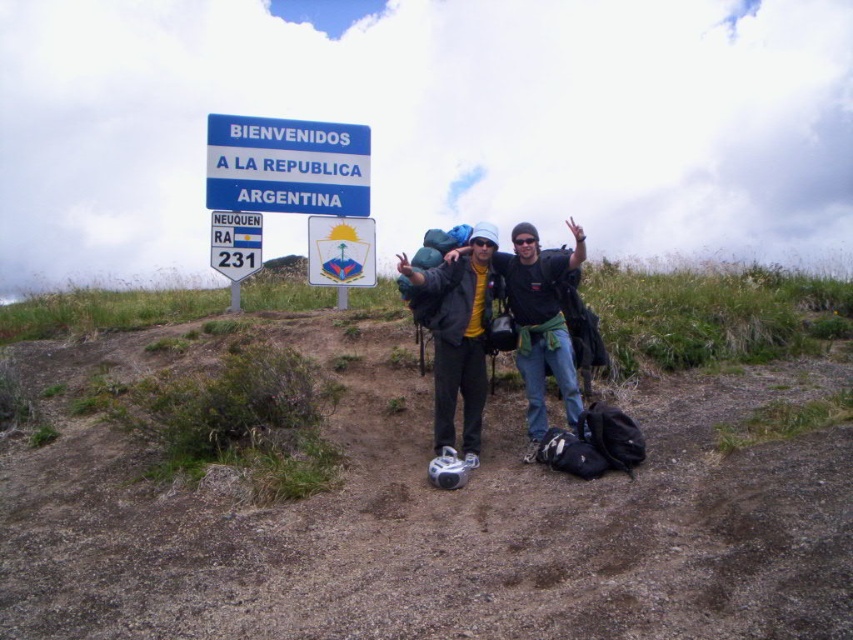
Question: Is matte black jacket at center above matte plastic sign at upper center?

Choices:
 (A) no
 (B) yes

Answer: (A)

Question: Among these points, which one is farthest from the camera?

Choices:
 (A) (514, 300)
 (B) (364, 236)
 (C) (215, 266)

Answer: (B)

Question: Which is farther from the matte black jacket at center?

Choices:
 (A) matte plastic sign at upper center
 (B) white plastic sign at upper center

Answer: (B)

Question: Considering the relative positions of matte black jacket at center and blue plastic sign at upper center in the image provided, where is matte black jacket at center located with respect to blue plastic sign at upper center?

Choices:
 (A) below
 (B) above

Answer: (A)

Question: Which object is positioned farthest from the white plastic sign at upper center?

Choices:
 (A) matte black jacket at center
 (B) blue plastic sign at upper center
 (C) matte plastic sign at upper center

Answer: (A)

Question: In this image, where is blue plastic sign at upper center located relative to matte plastic sign at upper center?

Choices:
 (A) below
 (B) above

Answer: (B)